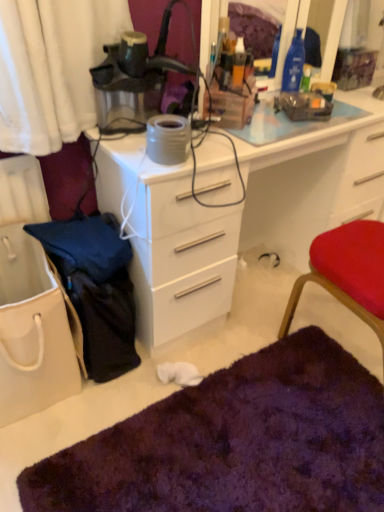
Question: Can you confirm if matte gray coffee cup at upper right is bigger than purple shaggy rug at lower center?

Choices:
 (A) no
 (B) yes

Answer: (A)

Question: Can you confirm if matte gray coffee cup at upper right is positioned to the left of purple shaggy rug at lower center?

Choices:
 (A) yes
 (B) no

Answer: (B)

Question: Considering the relative positions of matte gray coffee cup at upper right and purple shaggy rug at lower center in the image provided, is matte gray coffee cup at upper right in front of purple shaggy rug at lower center?

Choices:
 (A) yes
 (B) no

Answer: (B)

Question: Is purple shaggy rug at lower center a part of matte gray coffee cup at upper right?

Choices:
 (A) yes
 (B) no

Answer: (B)

Question: Is matte gray coffee cup at upper right aimed at purple shaggy rug at lower center?

Choices:
 (A) no
 (B) yes

Answer: (A)

Question: Is matte gray coffee cup at upper right outside of purple shaggy rug at lower center?

Choices:
 (A) no
 (B) yes

Answer: (B)

Question: Is white glossy desk at center aimed at clear glass mirror at upper center?

Choices:
 (A) no
 (B) yes

Answer: (A)

Question: Is white glossy desk at center beside clear glass mirror at upper center?

Choices:
 (A) no
 (B) yes

Answer: (A)

Question: Is clear glass mirror at upper center at the back of white glossy desk at center?

Choices:
 (A) yes
 (B) no

Answer: (B)

Question: From the image's perspective, does white glossy desk at center appear higher than clear glass mirror at upper center?

Choices:
 (A) yes
 (B) no

Answer: (B)

Question: From a real-world perspective, is white glossy desk at center located higher than clear glass mirror at upper center?

Choices:
 (A) no
 (B) yes

Answer: (A)

Question: From a real-world perspective, is white glossy desk at center physically below clear glass mirror at upper center?

Choices:
 (A) yes
 (B) no

Answer: (A)

Question: Does matte black lamp at upper center have a lesser width compared to purple shaggy rug at lower center?

Choices:
 (A) no
 (B) yes

Answer: (B)